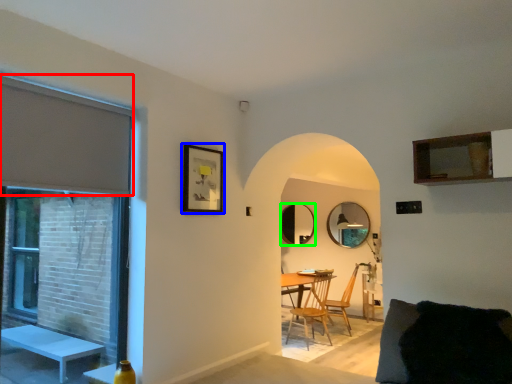
Question: Which object is positioned farthest from curtain (highlighted by a red box)? Select from picture frame (highlighted by a blue box) and mirror (highlighted by a green box).

Choices:
 (A) picture frame
 (B) mirror

Answer: (B)